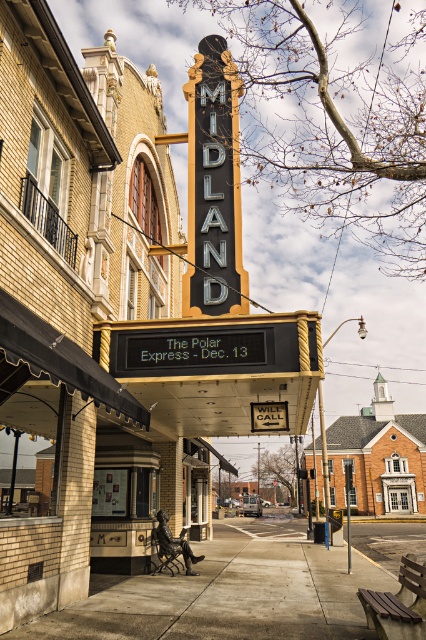
Question: Is gray concrete sidewalk at lower center positioned before matte black sign at center?

Choices:
 (A) yes
 (B) no

Answer: (A)

Question: Is gray concrete sidewalk at lower center below matte black sign at center?

Choices:
 (A) no
 (B) yes

Answer: (B)

Question: Which of the following is the farthest from the observer?

Choices:
 (A) gray concrete sidewalk at lower center
 (B) matte black sign at center

Answer: (B)

Question: Which object appears farthest from the camera in this image?

Choices:
 (A) matte black sign at center
 (B) gray concrete sidewalk at lower center

Answer: (A)

Question: Does gray concrete sidewalk at lower center have a larger size compared to matte black sign at center?

Choices:
 (A) no
 (B) yes

Answer: (B)